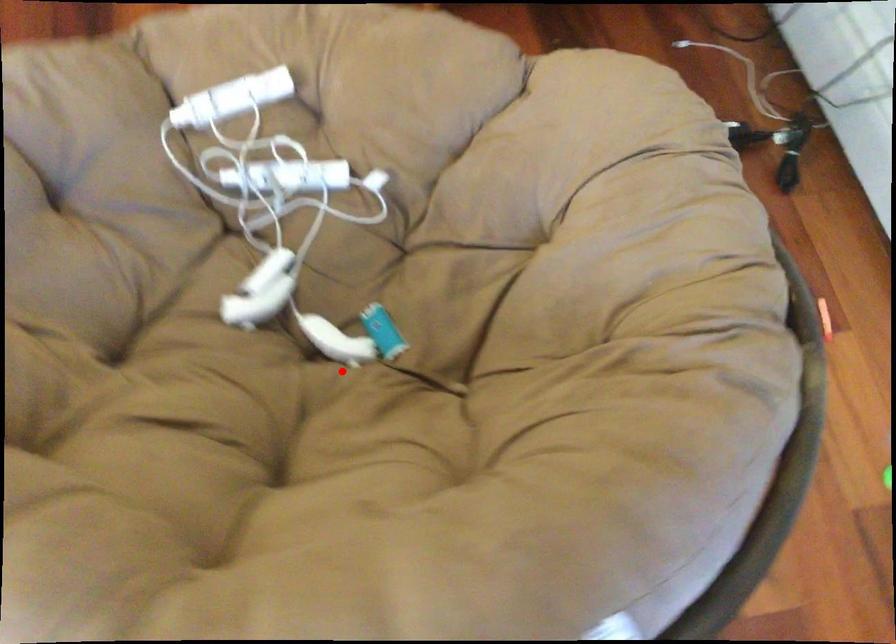
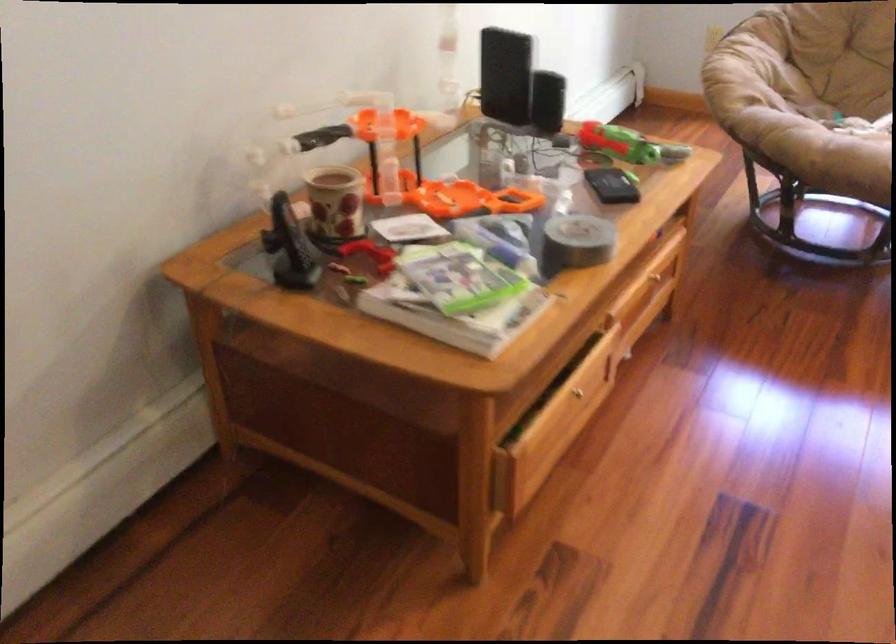
Question: A red point is marked in image1. In image2, is the corresponding 3D point closer to the camera or farther? Reply with the corresponding letter.

Choices:
 (A) The corresponding 3D point is closer.
 (B) The corresponding 3D point is farther.

Answer: (B)